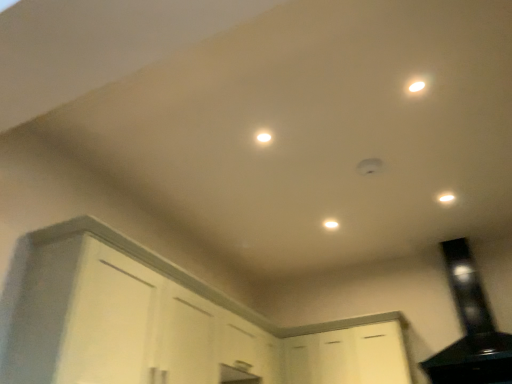
Where is `white matte light fixture at center`? The image size is (512, 384). white matte light fixture at center is located at coordinates (331, 224).

You are a GUI agent. You are given a task and a screenshot of the screen. Output one action in this format:
    pyautogui.click(x=<x>, y=<y>)
    Task: Click on the white glossy light at upper right, which is the first light in right-to-left order
    
    Given the screenshot: What is the action you would take?
    pyautogui.click(x=446, y=198)

Find the location of a particular element. The width and height of the screenshot is (512, 384). white glossy light at upper right, the 2th light from the right is located at coordinates (416, 87).

Describe the element at coordinates (166, 323) in the screenshot. This screenshot has width=512, height=384. I see `white matte cabinet at lower left, marked as the 1th cabinetry in a left-to-right arrangement` at that location.

You are a GUI agent. You are given a task and a screenshot of the screen. Output one action in this format:
    pyautogui.click(x=<x>, y=<y>)
    Task: Click on the black glossy exhaust hood at upper right
    This screenshot has height=384, width=512.
    Given the screenshot: What is the action you would take?
    pyautogui.click(x=470, y=328)

Looking at this image, how many degrees apart are the facing directions of white matte light fixture at center and white glossy light at center, the first light positioned from the left?

0.00059 degrees separate the facing orientations of white matte light fixture at center and white glossy light at center, the first light positioned from the left.

Does white matte light fixture at center have a greater height compared to white glossy light at center, arranged as the 2th light when ordered from the bottom?

Correct, white matte light fixture at center is much taller as white glossy light at center, arranged as the 2th light when ordered from the bottom.

From the image's perspective, is white matte light fixture at center located beneath white glossy light at center, arranged as the second light when viewed from the front?

Correct, white matte light fixture at center appears lower than white glossy light at center, arranged as the second light when viewed from the front, in the image.

Which of these two, white matte light fixture at center or white glossy light at center, positioned as the 3th light in right-to-left order, is thinner?

white glossy light at center, positioned as the 3th light in right-to-left order, is thinner.

How far apart are white matte cabinet at lower center, the 2th cabinetry in the left-to-right sequence, and white glossy light at center, positioned as the 3th light in right-to-left order?

white matte cabinet at lower center, the 2th cabinetry in the left-to-right sequence, is 1.88 meters away from white glossy light at center, positioned as the 3th light in right-to-left order.

Would you say white matte cabinet at lower center, the 2th cabinetry in the left-to-right sequence, contains white glossy light at center, the 2th light in the back-to-front sequence?

Definitely not — white glossy light at center, the 2th light in the back-to-front sequence, is not inside white matte cabinet at lower center, the 2th cabinetry in the left-to-right sequence.

Considering the sizes of white matte cabinet at lower center, which ranks as the 1th cabinetry in right-to-left order, and white glossy light at center, the first light positioned from the left, in the image, is white matte cabinet at lower center, which ranks as the 1th cabinetry in right-to-left order, taller or shorter than white glossy light at center, the first light positioned from the left,?

white matte cabinet at lower center, which ranks as the 1th cabinetry in right-to-left order, is taller than white glossy light at center, the first light positioned from the left.

Based on their positions, is white matte cabinet at lower center, which ranks as the 1th cabinetry in right-to-left order, located to the left or right of white glossy light at center, positioned as the 3th light in right-to-left order?

white matte cabinet at lower center, which ranks as the 1th cabinetry in right-to-left order, is to the right of white glossy light at center, positioned as the 3th light in right-to-left order.

Which object is further away from the camera, white glossy light at upper right, which ranks as the 3th light in left-to-right order, or black glossy exhaust hood at upper right?

white glossy light at upper right, which ranks as the 3th light in left-to-right order.

Between white glossy light at upper right, the 1th light from the back, and black glossy exhaust hood at upper right, which one has less height?

With less height is white glossy light at upper right, the 1th light from the back.

Is black glossy exhaust hood at upper right surrounded by white glossy light at upper right, the third light viewed from the front?

No, black glossy exhaust hood at upper right is located outside of white glossy light at upper right, the third light viewed from the front.

From the picture: Between white glossy light at upper right, which is the first light in right-to-left order, and black glossy exhaust hood at upper right, which one has larger width?

black glossy exhaust hood at upper right is wider.

In terms of width, does white matte cabinet at lower center, the 2th cabinetry in the left-to-right sequence, look wider or thinner when compared to white glossy light at upper right, the first light when ordered from top to bottom?

Clearly, white matte cabinet at lower center, the 2th cabinetry in the left-to-right sequence, has more width compared to white glossy light at upper right, the first light when ordered from top to bottom.

Identify the location of the 3rd light positioned above the white matte cabinet at lower center, the 2th cabinetry in the left-to-right sequence (from the image's perspective). (416, 87).

Is white matte cabinet at lower center, the 2th cabinetry in the left-to-right sequence, situated inside white glossy light at upper right, the 3th light when ordered from back to front, or outside?

The correct answer is: outside.

From a real-world perspective, who is located lower, white matte cabinet at lower left, marked as the second cabinetry in a right-to-left arrangement, or white matte light fixture at center?

white matte cabinet at lower left, marked as the second cabinetry in a right-to-left arrangement.

Find the location of a particular element. dot above the white matte cabinet at lower left, marked as the 1th cabinetry in a left-to-right arrangement (from a real-world perspective) is located at coordinates (331, 224).

Considering the sizes of objects white matte cabinet at lower left, marked as the 1th cabinetry in a left-to-right arrangement, and white matte light fixture at center in the image provided, who is smaller, white matte cabinet at lower left, marked as the 1th cabinetry in a left-to-right arrangement, or white matte light fixture at center?

With smaller size is white matte light fixture at center.

How much distance is there between white matte cabinet at lower left, marked as the 1th cabinetry in a left-to-right arrangement, and white matte light fixture at center?

white matte cabinet at lower left, marked as the 1th cabinetry in a left-to-right arrangement, is 4.42 feet away from white matte light fixture at center.

Could you tell me if white glossy light at center, the first light positioned from the left, is facing white glossy light at upper right, the 3th light when ordered from back to front?

Yes.

From a real-world perspective, who is located higher, white glossy light at center, which is counted as the 2th light, starting from the top, or white glossy light at upper right, which ranks as the 3th light in bottom-to-top order?

In real-world perspective, white glossy light at center, which is counted as the 2th light, starting from the top, is above.

In the scene shown: How different are the orientations of white glossy light at center, positioned as the 3th light in right-to-left order, and white glossy light at upper right, which ranks as the 3th light in bottom-to-top order, in degrees?

180 degrees.

Which is closer to the camera, [267,130] or [415,84]?

Clearly, point [267,130] is more distant from the camera than point [415,84].

Is white glossy light at center, which is counted as the 2th light, starting from the top, far from white matte cabinet at lower center, the 2th cabinetry in the left-to-right sequence?

That's right, there is a large distance between white glossy light at center, which is counted as the 2th light, starting from the top, and white matte cabinet at lower center, the 2th cabinetry in the left-to-right sequence.

Can you confirm if white glossy light at center, arranged as the 2th light when ordered from the bottom, is shorter than white matte cabinet at lower center, which ranks as the 1th cabinetry in right-to-left order?

Yes.

Is point (269, 140) closer to camera compared to point (320, 347)?

That is True.

From a real-world perspective, is white glossy light at center, arranged as the 2th light when ordered from the bottom, positioned under white matte cabinet at lower center, which ranks as the 1th cabinetry in right-to-left order, based on gravity?

No, from a real-world perspective, white glossy light at center, arranged as the 2th light when ordered from the bottom, is not beneath white matte cabinet at lower center, which ranks as the 1th cabinetry in right-to-left order.

Find the location of a particular element. light located above the white matte light fixture at center (from a real-world perspective) is located at coordinates (263, 137).

You are a GUI agent. You are given a task and a screenshot of the screen. Output one action in this format:
    pyautogui.click(x=<x>, y=<y>)
    Task: Click on the 1st cabinetry located beneath the white glossy light at center, which is counted as the 2th light, starting from the top (from a real-world perspective)
    
    Given the screenshot: What is the action you would take?
    pyautogui.click(x=348, y=353)

Based on their spatial positions, is white matte cabinet at lower left, marked as the second cabinetry in a right-to-left arrangement, or white glossy light at upper right, placed as the 3th light when sorted from top to bottom, closer to black glossy exhaust hood at upper right?

The object closer to black glossy exhaust hood at upper right is white glossy light at upper right, placed as the 3th light when sorted from top to bottom.

Based on their spatial positions, is white glossy light at upper right, which ranks as the 3th light in bottom-to-top order, or white matte cabinet at lower center, which ranks as the 1th cabinetry in right-to-left order, further from white glossy light at upper right, the 1th light from the back?

Among the two, white matte cabinet at lower center, which ranks as the 1th cabinetry in right-to-left order, is located further to white glossy light at upper right, the 1th light from the back.

Looking at the image, which one is located further to white glossy light at upper right, the 1th light from the back, white matte cabinet at lower left, marked as the second cabinetry in a right-to-left arrangement, or white glossy light at center, arranged as the 2th light when ordered from the bottom?

white matte cabinet at lower left, marked as the second cabinetry in a right-to-left arrangement, lies further to white glossy light at upper right, the 1th light from the back, than the other object.

Estimate the real-world distances between objects in this image. Which object is further from white matte cabinet at lower left, marked as the second cabinetry in a right-to-left arrangement, white glossy light at center, arranged as the second light when viewed from the front, or white glossy light at upper right, which is counted as the first light, starting from the front?

white glossy light at upper right, which is counted as the first light, starting from the front, is positioned further to the anchor white matte cabinet at lower left, marked as the second cabinetry in a right-to-left arrangement.

Which object lies further to the anchor point white glossy light at upper right, placed as the 3th light when sorted from top to bottom, white matte cabinet at lower center, which ranks as the 1th cabinetry in right-to-left order, or white matte cabinet at lower left, marked as the 1th cabinetry in a left-to-right arrangement?

Based on the image, white matte cabinet at lower left, marked as the 1th cabinetry in a left-to-right arrangement, appears to be further to white glossy light at upper right, placed as the 3th light when sorted from top to bottom.

Consider the image. Considering their positions, is black glossy exhaust hood at upper right positioned further to white matte cabinet at lower left, marked as the second cabinetry in a right-to-left arrangement, than white matte cabinet at lower center, which ranks as the 1th cabinetry in right-to-left order?

Based on the image, black glossy exhaust hood at upper right appears to be further to white matte cabinet at lower left, marked as the second cabinetry in a right-to-left arrangement.

Looking at the image, which one is located further to white glossy light at center, arranged as the second light when viewed from the front, white matte cabinet at lower left, marked as the second cabinetry in a right-to-left arrangement, or black glossy exhaust hood at upper right?

black glossy exhaust hood at upper right.

Considering their positions, is black glossy exhaust hood at upper right positioned closer to white matte light fixture at center than white glossy light at center, positioned as the 3th light in right-to-left order?

white glossy light at center, positioned as the 3th light in right-to-left order, is positioned closer to the anchor white matte light fixture at center.

The width and height of the screenshot is (512, 384). What are the coordinates of `exhaust hood between white matte light fixture at center and white matte cabinet at lower center, which ranks as the 1th cabinetry in right-to-left order, vertically` in the screenshot? It's located at (470, 328).

Where is `dot between white glossy light at center, the 2th light in the back-to-front sequence, and white glossy light at upper right, which ranks as the 3th light in left-to-right order`? dot between white glossy light at center, the 2th light in the back-to-front sequence, and white glossy light at upper right, which ranks as the 3th light in left-to-right order is located at coordinates (331, 224).

Where is `cabinetry between white glossy light at center, positioned as the 3th light in right-to-left order, and white matte cabinet at lower center, the 2th cabinetry in the left-to-right sequence, from top to bottom`? cabinetry between white glossy light at center, positioned as the 3th light in right-to-left order, and white matte cabinet at lower center, the 2th cabinetry in the left-to-right sequence, from top to bottom is located at coordinates (166, 323).

You are a GUI agent. You are given a task and a screenshot of the screen. Output one action in this format:
    pyautogui.click(x=<x>, y=<y>)
    Task: Click on the exhaust hood that lies between white glossy light at upper right, which is the first light in right-to-left order, and white matte cabinet at lower center, which ranks as the 1th cabinetry in right-to-left order, from top to bottom
    This screenshot has width=512, height=384.
    Given the screenshot: What is the action you would take?
    pyautogui.click(x=470, y=328)